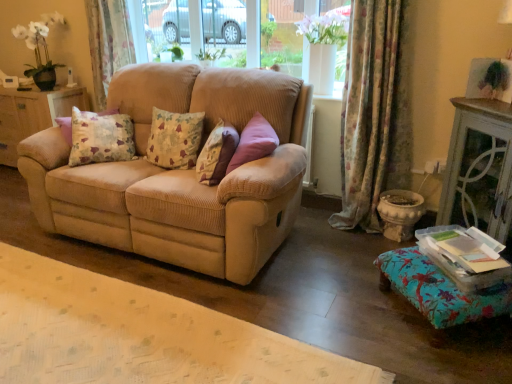
Question: Could you tell me if floral fabric curtain at upper left, positioned as the 1th curtain in left-to-right order, is facing floral fabric cushion at center, which ranks as the first pillow in left-to-right order?

Choices:
 (A) no
 (B) yes

Answer: (A)

Question: Is floral fabric curtain at upper left, the second curtain when ordered from right to left, not within floral fabric cushion at center, placed as the 2th pillow when sorted from right to left?

Choices:
 (A) yes
 (B) no

Answer: (A)

Question: From a real-world perspective, is floral fabric curtain at upper left, the first curtain viewed from the back, on top of floral fabric cushion at center, which ranks as the first pillow in left-to-right order?

Choices:
 (A) no
 (B) yes

Answer: (B)

Question: Does floral fabric curtain at upper left, arranged as the 2th curtain when viewed from the front, have a lesser height compared to floral fabric cushion at center, which ranks as the first pillow in left-to-right order?

Choices:
 (A) yes
 (B) no

Answer: (B)

Question: Can you confirm if floral fabric curtain at upper left, the first curtain viewed from the back, is wider than floral fabric cushion at center, which ranks as the first pillow in left-to-right order?

Choices:
 (A) no
 (B) yes

Answer: (B)

Question: Is point (454, 294) positioned closer to the camera than point (223, 125)?

Choices:
 (A) farther
 (B) closer

Answer: (B)

Question: Is floral fabric ottoman at lower right bigger or smaller than fluffy beige pillow at center, the 1th pillow when ordered from right to left?

Choices:
 (A) small
 (B) big

Answer: (B)

Question: In the image, is floral fabric ottoman at lower right positioned in front of or behind fluffy beige pillow at center, marked as the 2th pillow in a left-to-right arrangement?

Choices:
 (A) behind
 (B) front

Answer: (B)

Question: In terms of height, does floral fabric ottoman at lower right look taller or shorter compared to fluffy beige pillow at center, the 1th pillow when ordered from right to left?

Choices:
 (A) tall
 (B) short

Answer: (B)

Question: From the image's perspective, is fluffy beige pillow at center, marked as the 2th pillow in a left-to-right arrangement, positioned above or below beige corduroy couch at center?

Choices:
 (A) above
 (B) below

Answer: (A)

Question: Is fluffy beige pillow at center, marked as the 2th pillow in a left-to-right arrangement, wider or thinner than beige corduroy couch at center?

Choices:
 (A) wide
 (B) thin

Answer: (B)

Question: Is point (216, 135) closer or farther from the camera than point (139, 89)?

Choices:
 (A) farther
 (B) closer

Answer: (B)

Question: Is fluffy beige pillow at center, marked as the 2th pillow in a left-to-right arrangement, in front of or behind beige corduroy couch at center in the image?

Choices:
 (A) front
 (B) behind

Answer: (B)

Question: Is point (175, 114) closer or farther from the camera than point (251, 38)?

Choices:
 (A) farther
 (B) closer

Answer: (B)

Question: From the image's perspective, is floral fabric cushion at center, which ranks as the first pillow in left-to-right order, positioned above or below clear glass window at center?

Choices:
 (A) below
 (B) above

Answer: (A)